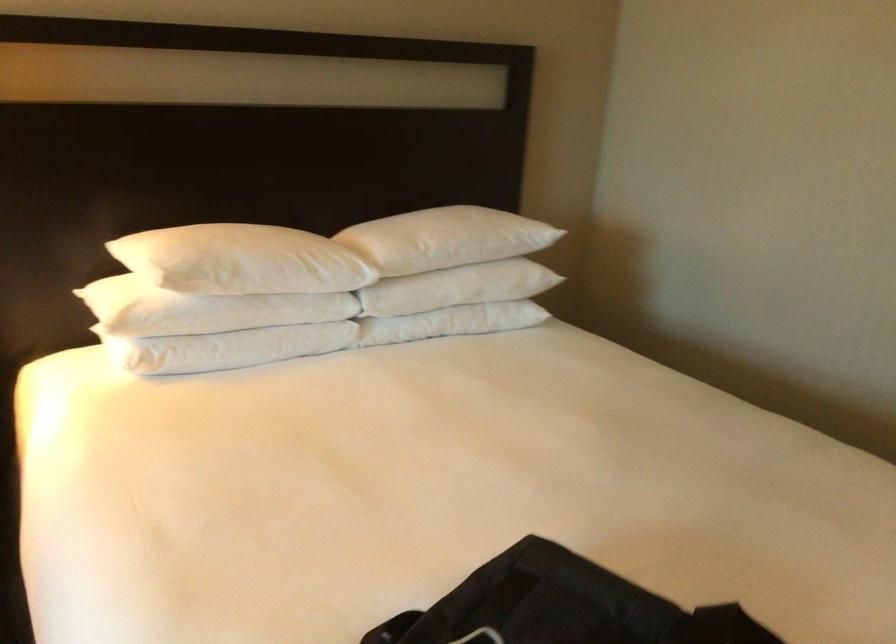
Image resolution: width=896 pixels, height=644 pixels. Find the location of `bag handle`. bag handle is located at coordinates (480, 637).